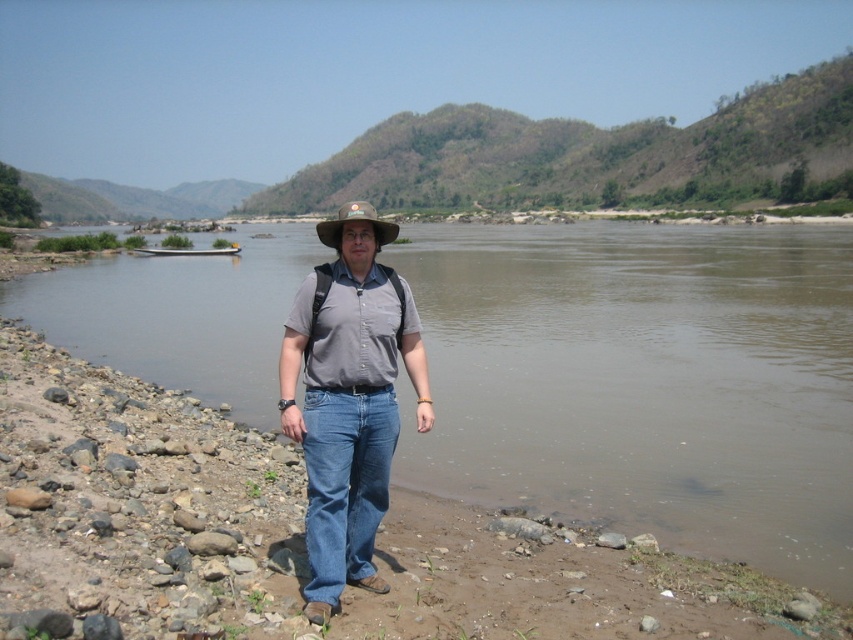
Question: Where is gray matte shirt at center located in relation to brown straw hat at center in the image?

Choices:
 (A) below
 (B) above

Answer: (A)

Question: Which object appears farthest from the camera in this image?

Choices:
 (A) gray matte shirt at center
 (B) brown straw hat at center
 (C) brown muddy water at center

Answer: (B)

Question: Which object is positioned farthest from the brown muddy water at center?

Choices:
 (A) brown straw hat at center
 (B) gray matte shirt at center

Answer: (B)

Question: Is the position of gray matte shirt at center less distant than that of brown straw hat at center?

Choices:
 (A) yes
 (B) no

Answer: (A)

Question: Is gray matte shirt at center to the right of brown straw hat at center from the viewer's perspective?

Choices:
 (A) yes
 (B) no

Answer: (A)

Question: Among these objects, which one is farthest from the camera?

Choices:
 (A) brown straw hat at center
 (B) gray matte shirt at center
 (C) brown muddy water at center

Answer: (A)